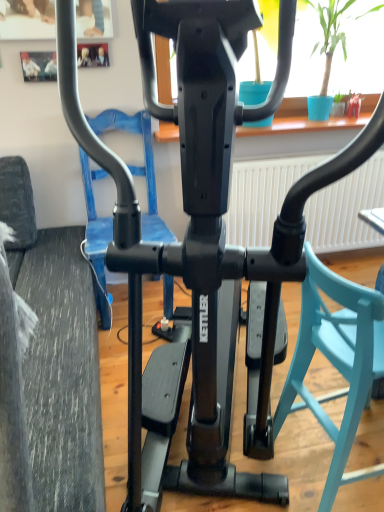
Describe the element at coordinates (336, 362) in the screenshot. I see `teal plastic swivel chair at center-right` at that location.

Image resolution: width=384 pixels, height=512 pixels. What are the coordinates of `teal plastic swivel chair at center-right` in the screenshot? It's located at (336, 362).

Measure the distance between point (322, 321) and camera.

The depth of point (322, 321) is 3.93 feet.

You are a GUI agent. You are given a task and a screenshot of the screen. Output one action in this format:
    pyautogui.click(x=<x>, y=<y>)
    Task: Click on the teal plastic swivel chair at center-right
    The height and width of the screenshot is (512, 384).
    Given the screenshot: What is the action you would take?
    pyautogui.click(x=336, y=362)